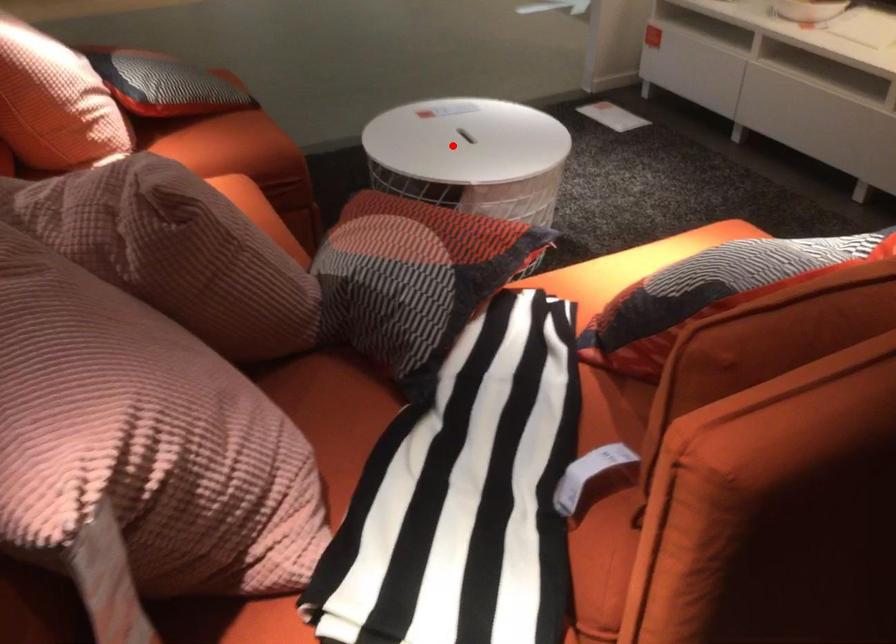
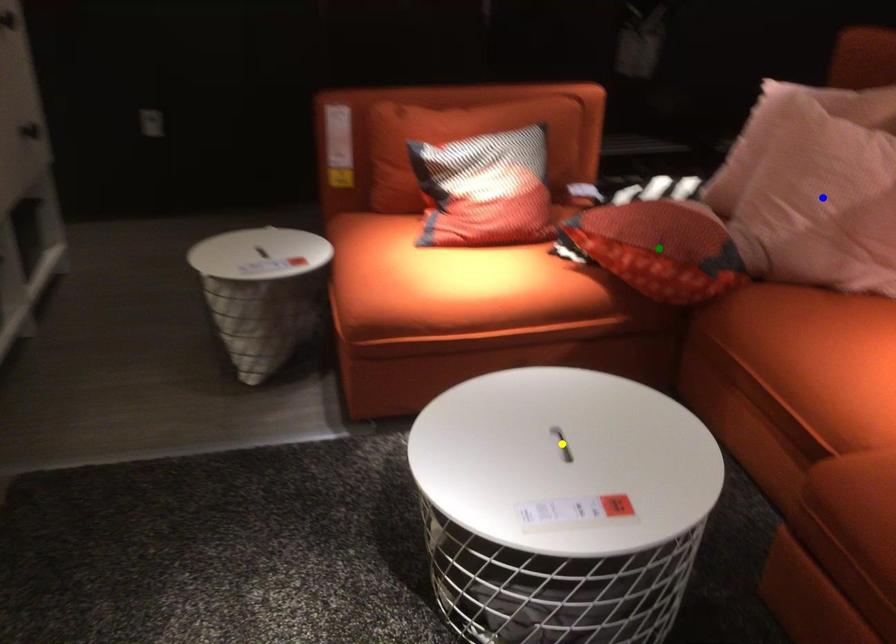
Question: I am providing you with two images of the same scene from different viewpoints. A red point is marked on the first image. You are given multiple points on the second image. Which point in image 2 represents the same 3d spot as the red point in image 1?

Choices:
 (A) green point
 (B) yellow point
 (C) blue point

Answer: (B)